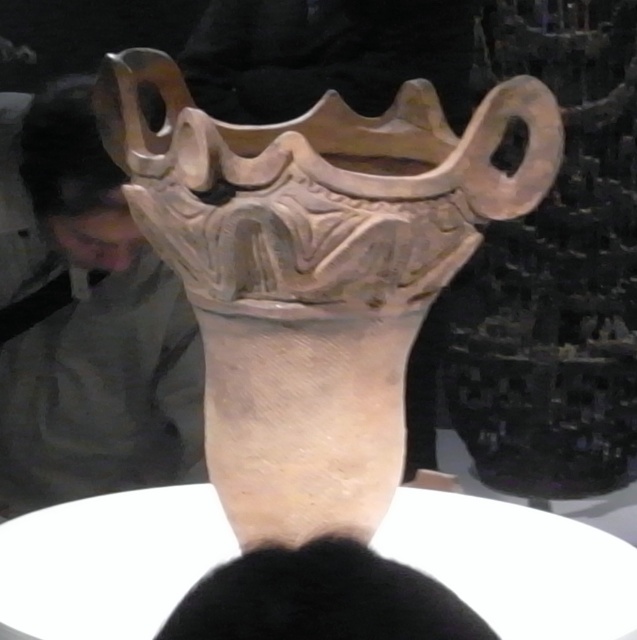
Question: Among these objects, which one is farthest from the camera?

Choices:
 (A) matte clay vase at center
 (B) matte gray sculpture at upper left

Answer: (B)

Question: Can you confirm if matte clay vase at center is smaller than matte gray sculpture at upper left?

Choices:
 (A) no
 (B) yes

Answer: (B)

Question: Is matte clay vase at center further to the viewer compared to matte gray sculpture at upper left?

Choices:
 (A) yes
 (B) no

Answer: (B)

Question: Is matte clay vase at center thinner than matte gray sculpture at upper left?

Choices:
 (A) no
 (B) yes

Answer: (A)

Question: Which point is farther to the camera?

Choices:
 (A) (434, 218)
 (B) (62, 323)

Answer: (B)